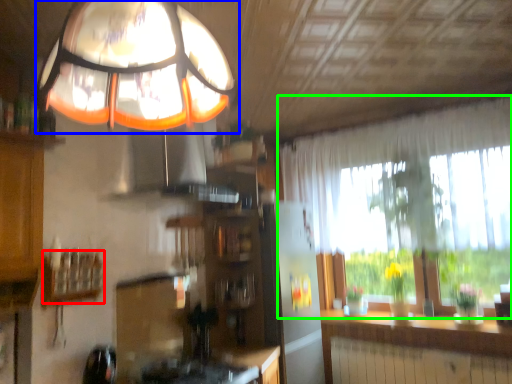
Question: Which object is the farthest from shelf (highlighted by a red box)? Choose among these: lamp (highlighted by a blue box) or window (highlighted by a green box).

Choices:
 (A) lamp
 (B) window

Answer: (B)